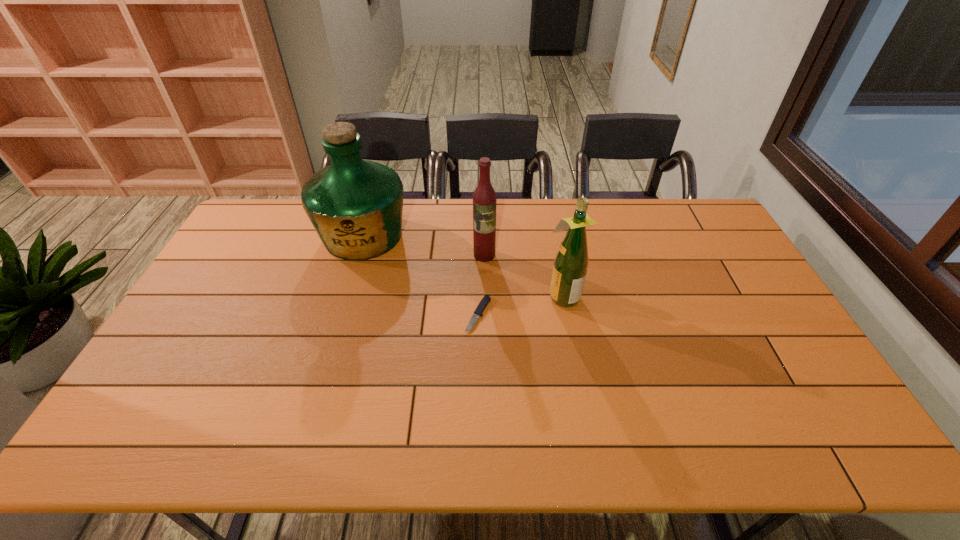
At what (x,y) coordinates should I click in order to perform the action: click on free space between the leftmost liquor and the steak knife. Please return your answer as a coordinate pair (x, y). This screenshot has width=960, height=540. Looking at the image, I should click on (420, 275).

This screenshot has width=960, height=540. I want to click on free space between the steak knife and the second liquor from right to left, so click(481, 285).

Where is `unoccupied area between the rightmost liquor and the leftmost object`? The image size is (960, 540). unoccupied area between the rightmost liquor and the leftmost object is located at coordinates (463, 266).

This screenshot has width=960, height=540. Find the location of `vacant area that lies between the nearest liquor and the shortest object`. vacant area that lies between the nearest liquor and the shortest object is located at coordinates (520, 305).

At what (x,y) coordinates should I click in order to perform the action: click on free spot between the shortest object and the nearest liquor. Please return your answer as a coordinate pair (x, y). The height and width of the screenshot is (540, 960). Looking at the image, I should click on (520, 305).

You are a GUI agent. You are given a task and a screenshot of the screen. Output one action in this format:
    pyautogui.click(x=<x>, y=<y>)
    Task: Click on the vacant region between the leftmost object and the shortest object
    The height and width of the screenshot is (540, 960).
    Given the screenshot: What is the action you would take?
    pyautogui.click(x=420, y=275)

This screenshot has height=540, width=960. Identify the location of vacant region between the shortest object and the leftmost liquor. (420, 275).

Find the location of a particular element. Image resolution: width=960 pixels, height=540 pixels. vacant region between the rightmost liquor and the steak knife is located at coordinates (520, 305).

What are the coordinates of `the closest object relative to the rightmost object` in the screenshot? It's located at (485, 300).

Identify the location of object that is the third closest to the rightmost liquor. This screenshot has width=960, height=540. (355, 205).